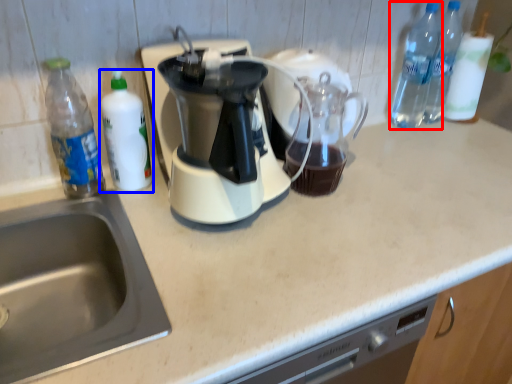
Question: Which object is further to the camera taking this photo, bottle (highlighted by a red box) or bottle (highlighted by a blue box)?

Choices:
 (A) bottle
 (B) bottle

Answer: (A)